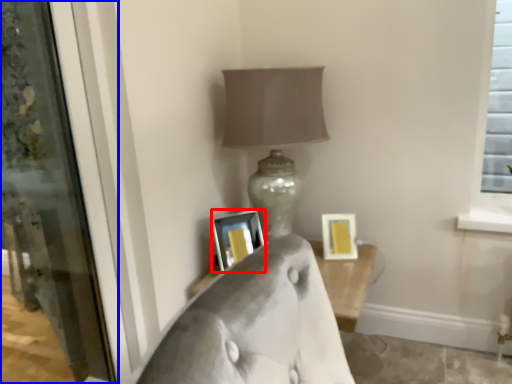
Question: Which object appears farthest to the camera in this image, picture frame (highlighted by a red box) or screen door (highlighted by a blue box)?

Choices:
 (A) picture frame
 (B) screen door

Answer: (A)